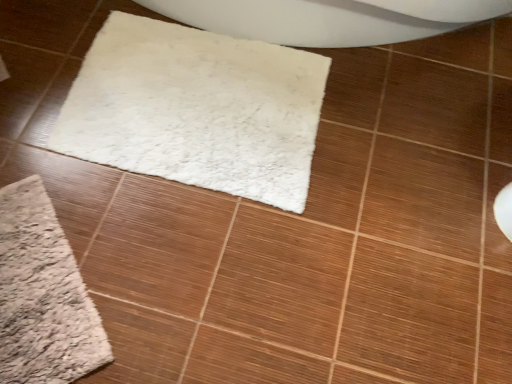
The height and width of the screenshot is (384, 512). What are the coordinates of `white fluffy mat at center` in the screenshot? It's located at (196, 109).

This screenshot has height=384, width=512. Describe the element at coordinates (196, 109) in the screenshot. I see `white fluffy mat at center` at that location.

What do you see at coordinates (42, 295) in the screenshot? The width and height of the screenshot is (512, 384). I see `beige fuzzy bath mat at lower left` at bounding box center [42, 295].

The width and height of the screenshot is (512, 384). Find the location of `beige fuzzy bath mat at lower left`. beige fuzzy bath mat at lower left is located at coordinates (42, 295).

I want to click on white fluffy mat at center, so click(196, 109).

From the picture: Is beige fuzzy bath mat at lower left to the left or to the right of white fluffy mat at center in the image?

beige fuzzy bath mat at lower left is positioned on white fluffy mat at center's left side.

Is the position of beige fuzzy bath mat at lower left less distant than that of white fluffy mat at center?

Yes, beige fuzzy bath mat at lower left is closer to the viewer.

Considering the positions of point (16, 209) and point (303, 140), is point (16, 209) closer or farther from the camera than point (303, 140)?

Point (16, 209) appears to be closer to the viewer than point (303, 140).

From the image's perspective, which one is positioned higher, beige fuzzy bath mat at lower left or white fluffy mat at center?

white fluffy mat at center is shown above in the image.

From a real-world perspective, is beige fuzzy bath mat at lower left physically above white fluffy mat at center?

No, from a real-world perspective, beige fuzzy bath mat at lower left is not on top of white fluffy mat at center.

Which of these two, beige fuzzy bath mat at lower left or white fluffy mat at center, is thinner?

beige fuzzy bath mat at lower left.

Is beige fuzzy bath mat at lower left shorter than white fluffy mat at center?

Yes, beige fuzzy bath mat at lower left is shorter than white fluffy mat at center.

In terms of size, does beige fuzzy bath mat at lower left appear bigger or smaller than white fluffy mat at center?

Considering their sizes, beige fuzzy bath mat at lower left takes up less space than white fluffy mat at center.

Would you say beige fuzzy bath mat at lower left is outside white fluffy mat at center?

beige fuzzy bath mat at lower left lies outside white fluffy mat at center's area.

Are beige fuzzy bath mat at lower left and white fluffy mat at center far apart?

beige fuzzy bath mat at lower left is near white fluffy mat at center, not far away.

Is beige fuzzy bath mat at lower left positioned with its back to white fluffy mat at center?

That's not correct — beige fuzzy bath mat at lower left is not looking away from white fluffy mat at center.

How different are the orientations of beige fuzzy bath mat at lower left and white fluffy mat at center in degrees?

There is a 134-degree angle between the facing directions of beige fuzzy bath mat at lower left and white fluffy mat at center.

The width and height of the screenshot is (512, 384). I want to click on mat that appears above the beige fuzzy bath mat at lower left (from the image's perspective), so click(x=196, y=109).

Considering the positions of objects white fluffy mat at center and beige fuzzy bath mat at lower left in the image provided, who is more to the left, white fluffy mat at center or beige fuzzy bath mat at lower left?

Positioned to the left is beige fuzzy bath mat at lower left.

Is white fluffy mat at center closer to the viewer compared to beige fuzzy bath mat at lower left?

No, white fluffy mat at center is further to the viewer.

Is point (76, 131) closer or farther from the camera than point (40, 215)?

Clearly, point (76, 131) is more distant from the camera than point (40, 215).

From the image's perspective, who appears lower, white fluffy mat at center or beige fuzzy bath mat at lower left?

beige fuzzy bath mat at lower left.

From a real-world perspective, relative to beige fuzzy bath mat at lower left, is white fluffy mat at center vertically above or below?

In terms of real-world spatial position, white fluffy mat at center is above beige fuzzy bath mat at lower left.

Which of these two, white fluffy mat at center or beige fuzzy bath mat at lower left, is thinner?

Thinner between the two is beige fuzzy bath mat at lower left.

Is white fluffy mat at center shorter than beige fuzzy bath mat at lower left?

In fact, white fluffy mat at center may be taller than beige fuzzy bath mat at lower left.

Considering the relative sizes of white fluffy mat at center and beige fuzzy bath mat at lower left in the image provided, is white fluffy mat at center smaller than beige fuzzy bath mat at lower left?

Incorrect, white fluffy mat at center is not smaller in size than beige fuzzy bath mat at lower left.

Is white fluffy mat at center not within beige fuzzy bath mat at lower left?

white fluffy mat at center lies outside beige fuzzy bath mat at lower left's area.

Is white fluffy mat at center positioned far away from beige fuzzy bath mat at lower left?

white fluffy mat at center is actually quite close to beige fuzzy bath mat at lower left.

In the scene shown: Is white fluffy mat at center oriented towards beige fuzzy bath mat at lower left?

Yes, white fluffy mat at center is oriented towards beige fuzzy bath mat at lower left.

Consider the image. What's the angular difference between white fluffy mat at center and beige fuzzy bath mat at lower left's facing directions?

The angular difference between white fluffy mat at center and beige fuzzy bath mat at lower left is 134 degrees.

The image size is (512, 384). Identify the location of bath mat below the white fluffy mat at center (from the image's perspective). click(42, 295).

Find the location of `bath mat beneath the white fluffy mat at center (from a real-world perspective)`. bath mat beneath the white fluffy mat at center (from a real-world perspective) is located at coordinates (42, 295).

Find the location of a particular element. The width and height of the screenshot is (512, 384). bath mat to the left of white fluffy mat at center is located at coordinates click(42, 295).